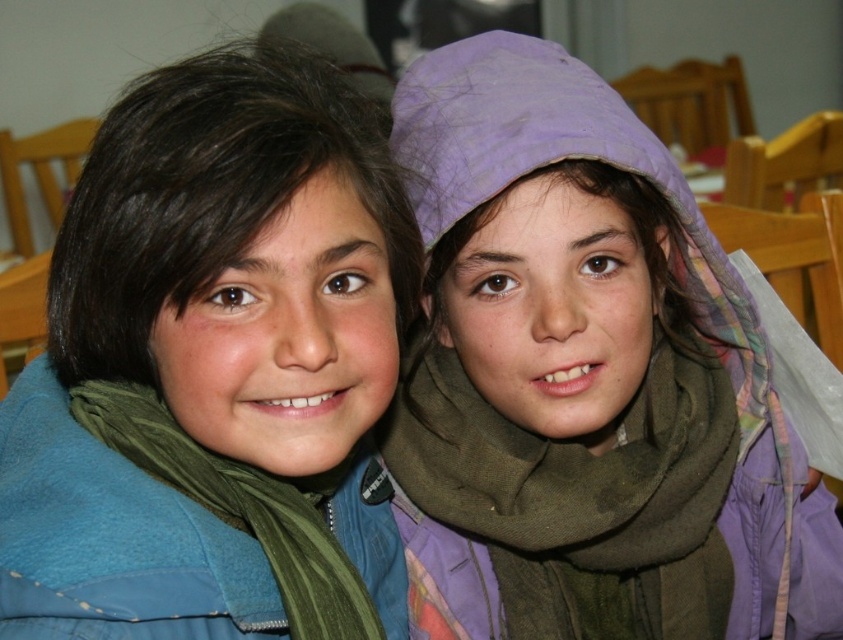
Can you confirm if green fleece jacket at left is thinner than green fabric scarf at center?

A: Yes.

Does point (138, 84) come in front of point (422, 499)?

No, it is not.

Who is more distant from viewer, (234, 326) or (398, 410)?

Point (398, 410)

At what (x,y) coordinates should I click in order to perform the action: click on green fleece jacket at left. Please return your answer as a coordinate pair (x, y). Looking at the image, I should click on (207, 348).

Can you confirm if purple fabric headscarf at upper right is positioned above green fabric scarf at center?

Indeed, purple fabric headscarf at upper right is positioned over green fabric scarf at center.

Does purple fabric headscarf at upper right have a larger size compared to green fabric scarf at center?

Yes.

Does point (561, 369) come in front of point (432, 346)?

Yes, it is in front of point (432, 346).

Locate an element on the screen. Image resolution: width=843 pixels, height=640 pixels. purple fabric headscarf at upper right is located at coordinates (593, 364).

Does purple fabric headscarf at upper right come behind green matte scarf at lower left?

Yes, purple fabric headscarf at upper right is further from the viewer.

This screenshot has width=843, height=640. I want to click on purple fabric headscarf at upper right, so click(593, 364).

The width and height of the screenshot is (843, 640). What do you see at coordinates (593, 364) in the screenshot?
I see `purple fabric headscarf at upper right` at bounding box center [593, 364].

I want to click on purple fabric headscarf at upper right, so click(x=593, y=364).